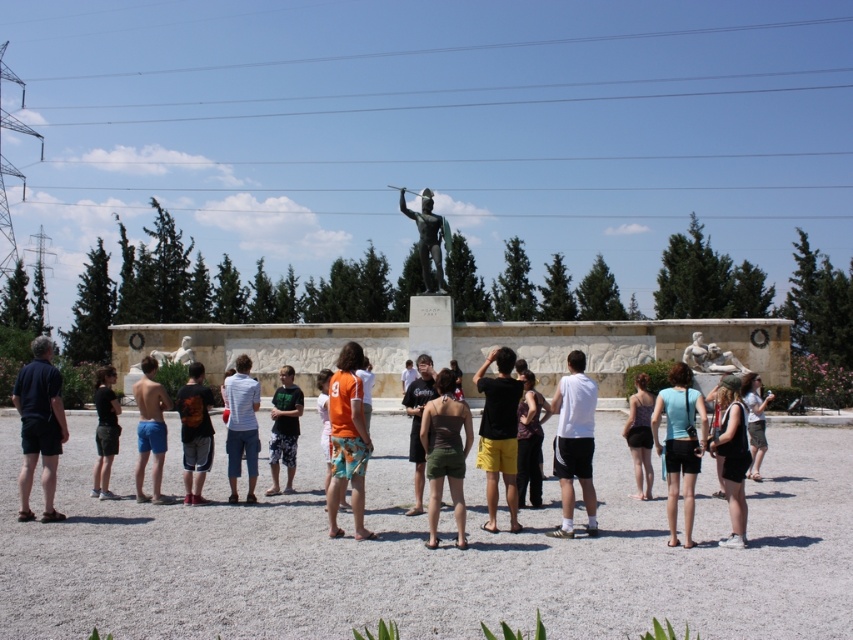
You are a photographer trying to capture a clear photo of the monument. There are two people blocking your view at the center of the frame, a white cotton shirt at center and light blue denim shorts at center. Which of the two is larger in size and might be easier to ask to move aside?

The white cotton shirt at center is bigger than the light blue denim shorts at center, so it might be easier to ask the person wearing the white cotton shirt at center to move aside as they are taking up more space in the frame.

You are a photographer trying to capture a group photo of the tourists. You notice the white cotton shirt at center and the light blue denim shorts at center. Which clothing item has a greater width in the image?

The white cotton shirt at center has a greater width than the light blue denim shorts at center according to the description.

You are a photographer trying to capture a group photo of the tourists near the monument. You notice two people wearing black cotton shirt at center and white cotton shirt at center. Which person should you ask to move slightly to the side to ensure both can fit comfortably in the frame?

The black cotton shirt at center has a smaller width than the white cotton shirt at center, so you should ask the person wearing the white cotton shirt at center to move slightly to the side to accommodate both in the frame.